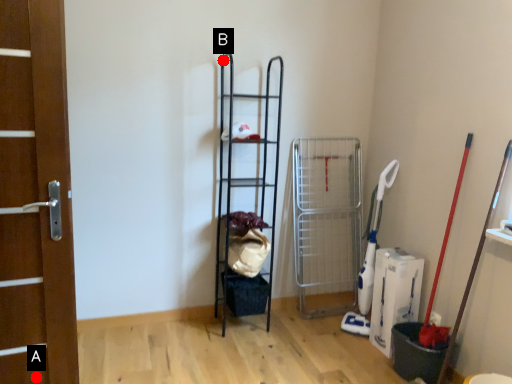
Question: Two points are circled on the image, labeled by A and B beside each circle. Which point is closer to the camera?

Choices:
 (A) A is closer
 (B) B is closer

Answer: (A)